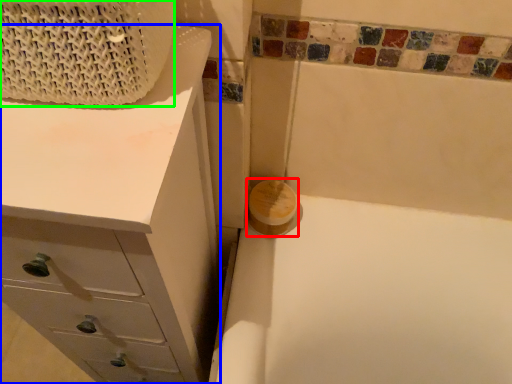
Question: Which object is the closest to the soap (highlighted by a red box)? Choose among these: chest of drawers (highlighted by a blue box) or basket (highlighted by a green box).

Choices:
 (A) chest of drawers
 (B) basket

Answer: (A)